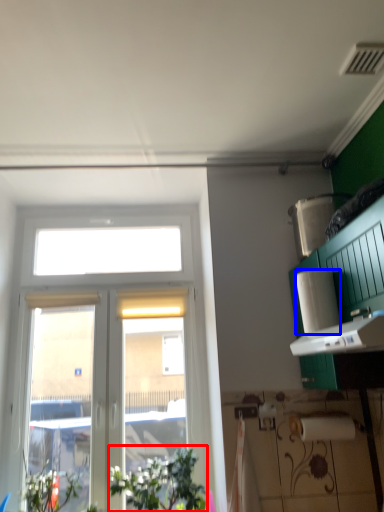
Question: Which object is further to the camera taking this photo, plant (highlighted by a red box) or paper towel (highlighted by a blue box)?

Choices:
 (A) plant
 (B) paper towel

Answer: (A)